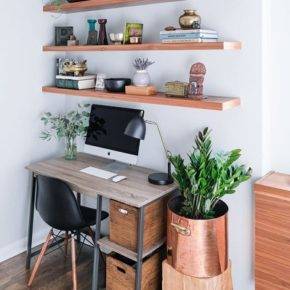
This screenshot has width=290, height=290. Find the location of `table lamp`. table lamp is located at coordinates (132, 128).